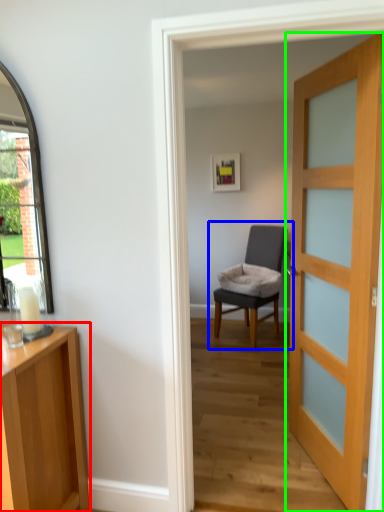
Question: Which object is positioned farthest from cabinetry (highlighted by a red box)? Select from chair (highlighted by a blue box) and door (highlighted by a green box).

Choices:
 (A) chair
 (B) door

Answer: (A)